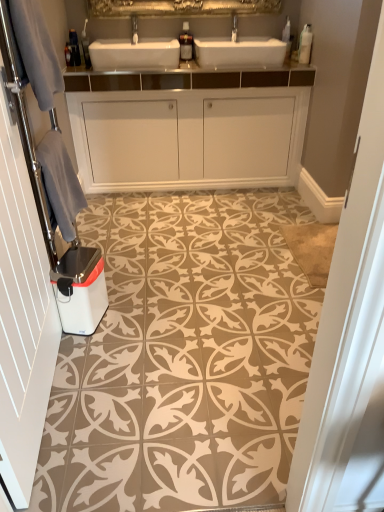
I want to click on vacant space to the right of white glossy dishwasher at lower left, so click(127, 317).